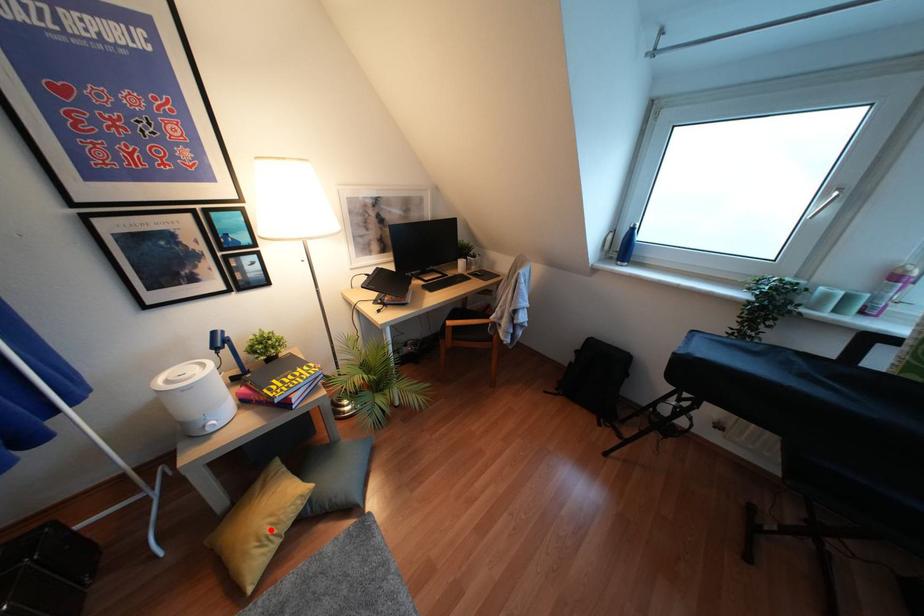
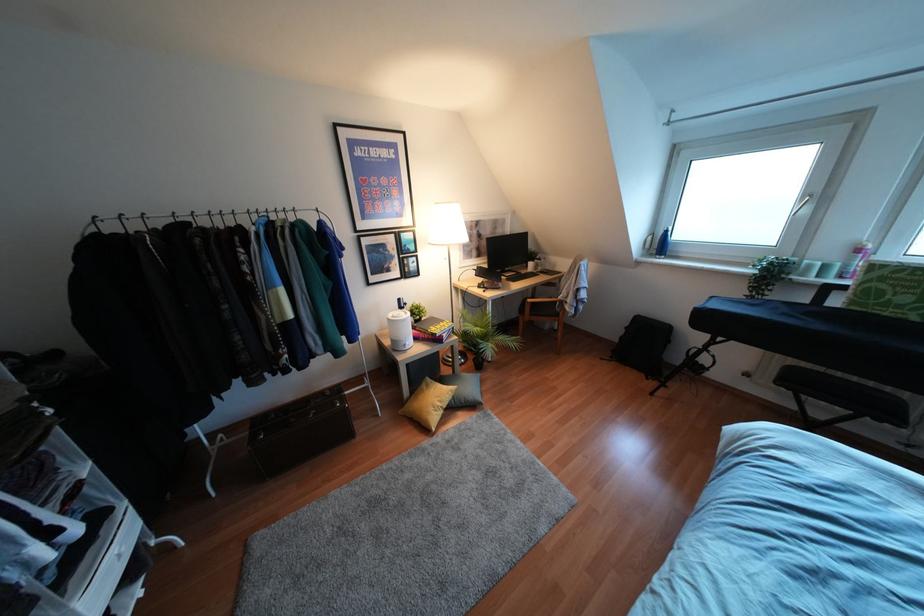
In the second image, find the point that corresponds to the highlighted location in the first image.

(439, 403)